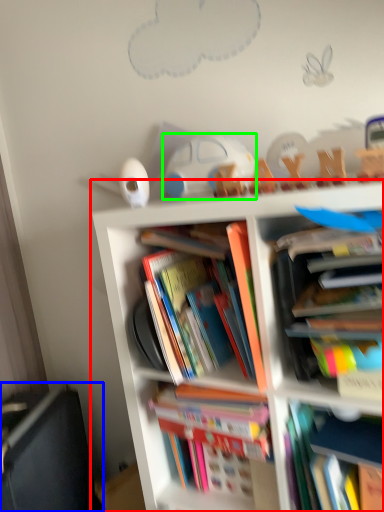
Question: Which object is positioned farthest from bookcase (highlighted by a red box)? Select from shelf (highlighted by a blue box) and toy (highlighted by a green box).

Choices:
 (A) shelf
 (B) toy

Answer: (A)